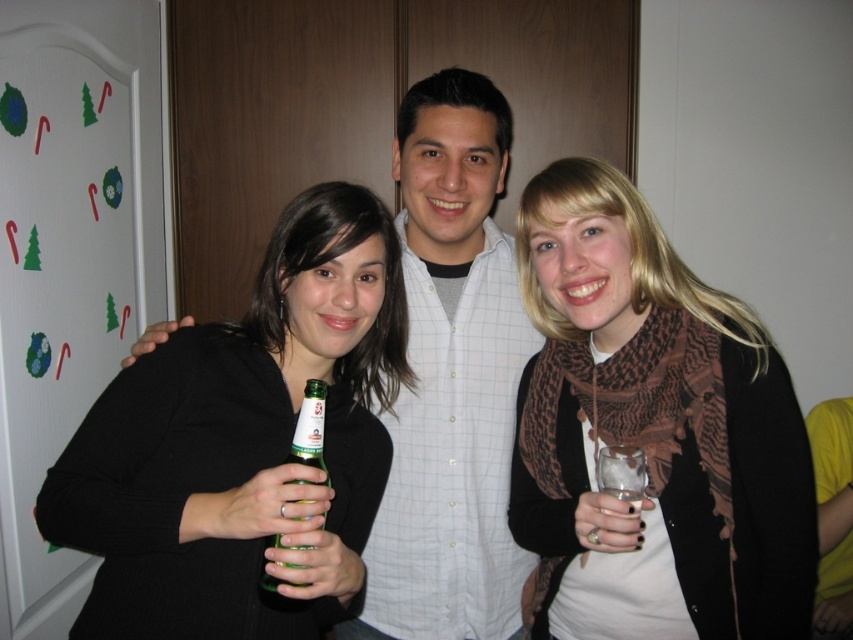
Question: Which is farther from the brown textured scarf at right?

Choices:
 (A) black matte shirt at left
 (B) clear glass at center
 (C) white checkered shirt at center
 (D) green glass bottle at center

Answer: (D)

Question: Which object is farther from the camera taking this photo?

Choices:
 (A) clear glass at center
 (B) black matte shirt at left

Answer: (A)

Question: Considering the relative positions of green glass bottle at center and clear glass at center in the image provided, where is green glass bottle at center located with respect to clear glass at center?

Choices:
 (A) below
 (B) above

Answer: (B)

Question: Is brown textured scarf at right to the left of clear glass at center from the viewer's perspective?

Choices:
 (A) no
 (B) yes

Answer: (A)

Question: Which is farther from the brown textured scarf at right?

Choices:
 (A) black matte shirt at left
 (B) white checkered shirt at center
 (C) green glass bottle at center
 (D) clear glass at center

Answer: (C)

Question: Can you confirm if black matte shirt at left is positioned below clear glass at center?

Choices:
 (A) no
 (B) yes

Answer: (A)